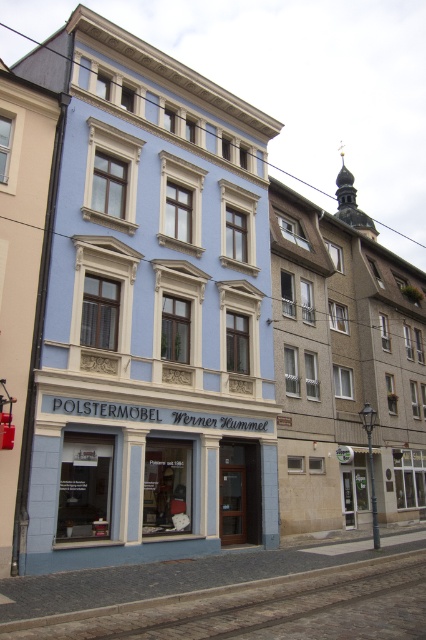
You are standing at the point with coordinates (137, 509) and want to walk to the point with coordinates (350, 445). Based on the scene description, will you be moving towards the building on the left or the right side?

You will be moving towards the building on the left because point (350, 445) is behind point (137, 509), indicating it is further away in the direction of the left building.